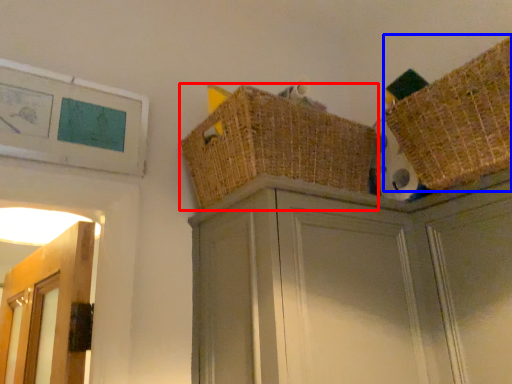
Question: Which object is closer to the camera taking this photo, basket (highlighted by a red box) or basket (highlighted by a blue box)?

Choices:
 (A) basket
 (B) basket

Answer: (B)